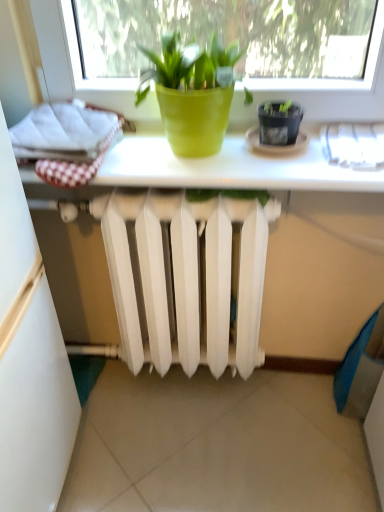
Question: Is green matte pot at center thinner than black plastic flowerpot at upper right?

Choices:
 (A) no
 (B) yes

Answer: (A)

Question: Is green matte pot at center in contact with black plastic flowerpot at upper right?

Choices:
 (A) no
 (B) yes

Answer: (A)

Question: Does green matte pot at center lie in front of black plastic flowerpot at upper right?

Choices:
 (A) no
 (B) yes

Answer: (B)

Question: Does green matte pot at center turn towards black plastic flowerpot at upper right?

Choices:
 (A) yes
 (B) no

Answer: (B)

Question: Considering the relative sizes of green matte pot at center and black plastic flowerpot at upper right in the image provided, is green matte pot at center bigger than black plastic flowerpot at upper right?

Choices:
 (A) no
 (B) yes

Answer: (B)

Question: Does green matte pot at center lie behind black plastic flowerpot at upper right?

Choices:
 (A) yes
 (B) no

Answer: (B)

Question: Is black plastic flowerpot at upper right facing towards green matte pot at center?

Choices:
 (A) yes
 (B) no

Answer: (B)

Question: Would you say black plastic flowerpot at upper right contains green matte pot at center?

Choices:
 (A) yes
 (B) no

Answer: (B)

Question: From a real-world perspective, is black plastic flowerpot at upper right on green matte pot at center?

Choices:
 (A) yes
 (B) no

Answer: (B)

Question: Can you confirm if black plastic flowerpot at upper right is wider than green matte pot at center?

Choices:
 (A) no
 (B) yes

Answer: (A)

Question: From the image's perspective, is black plastic flowerpot at upper right above green matte pot at center?

Choices:
 (A) no
 (B) yes

Answer: (A)

Question: Is black plastic flowerpot at upper right at the right side of green matte pot at center?

Choices:
 (A) no
 (B) yes

Answer: (B)

Question: Visually, is green matte pot at center positioned to the left or to the right of black plastic flowerpot at upper right?

Choices:
 (A) left
 (B) right

Answer: (A)